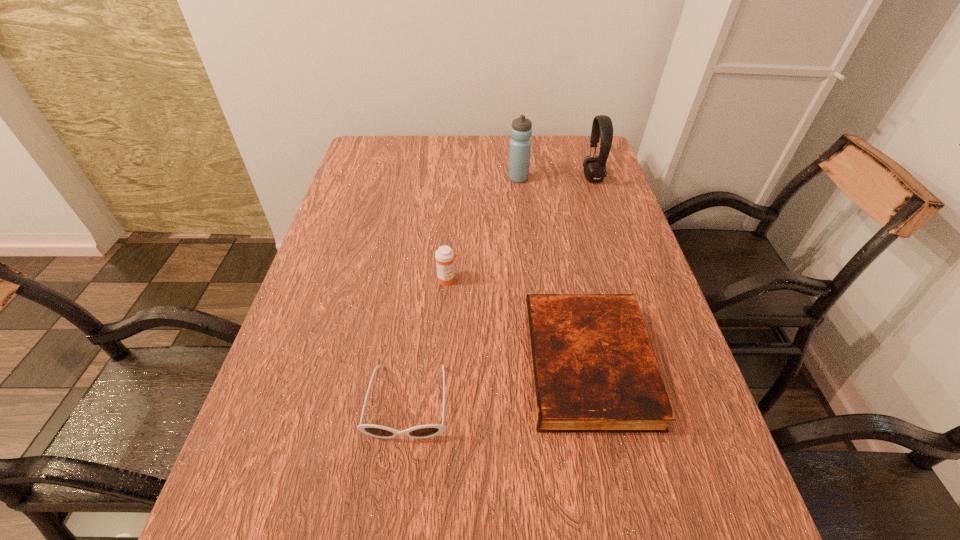
Identify the location of free region that satisfies the following two spatial constraints: 1. on the front-facing side of the headset; 2. on the front side of the water bottle. pos(593,178).